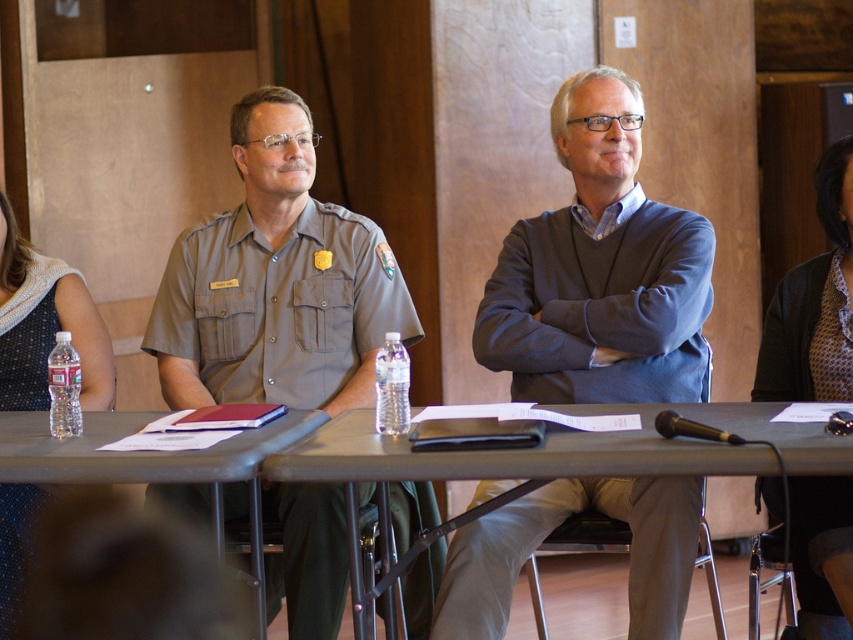
You are attending a meeting and need to determine which clothing item is taller between the patterned fabric shirt at right and the blue textured dress at left. Based on the scene, which one is taller?

The patterned fabric shirt at right is taller than the blue textured dress at left according to the description.

Please provide the 2D coordinates of the metallic gray table at center in the image. The answer should be formatted as a point with two decimal places, like this example format for a point at 0.5, 0.5 would be written as 0.50,0.50. Please strictly adhere to this format without any additional text or explanation.

(571, 448)

You are a photographer taking a picture of the scene. You notice the patterned fabric shirt at right and the clear plastic water bottle at left. Which object will appear larger in the photo?

The patterned fabric shirt at right is much taller than the clear plastic water bottle at left, so it will appear larger in the photo.